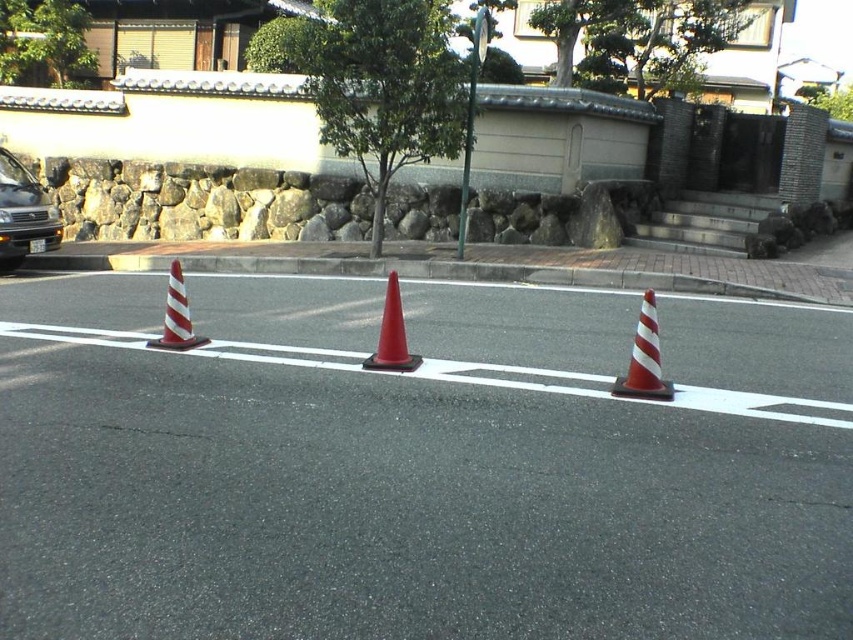
Question: Among these points, which one is nearest to the camera?

Choices:
 (A) (666, 385)
 (B) (514, 371)
 (C) (412, 369)

Answer: (A)

Question: Does white striped plastic traffic cone at left appear under white plastic traffic sign at center?

Choices:
 (A) yes
 (B) no

Answer: (A)

Question: Is metallic green traffic sign at center to the right of white striped plastic traffic cone at left from the viewer's perspective?

Choices:
 (A) yes
 (B) no

Answer: (A)

Question: Which object appears closest to the camera in this image?

Choices:
 (A) white plastic traffic sign at center
 (B) matte black car at left

Answer: (B)

Question: Is white striped plastic traffic cone at left to the right of white plastic traffic sign at center from the viewer's perspective?

Choices:
 (A) yes
 (B) no

Answer: (B)

Question: Which point is closer to the camera taking this photo?

Choices:
 (A) (653, 362)
 (B) (461, 220)
 (C) (6, 268)
 (D) (488, 17)

Answer: (A)